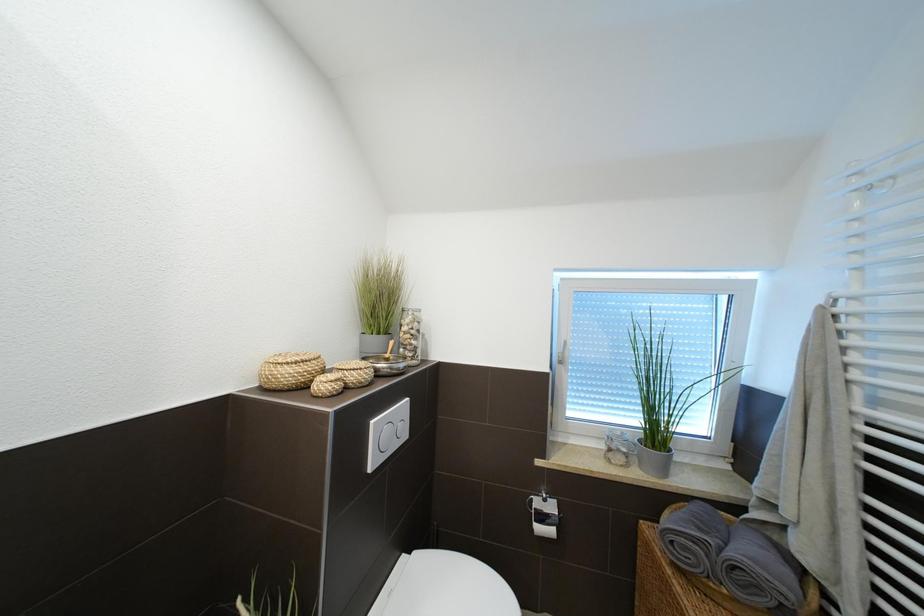
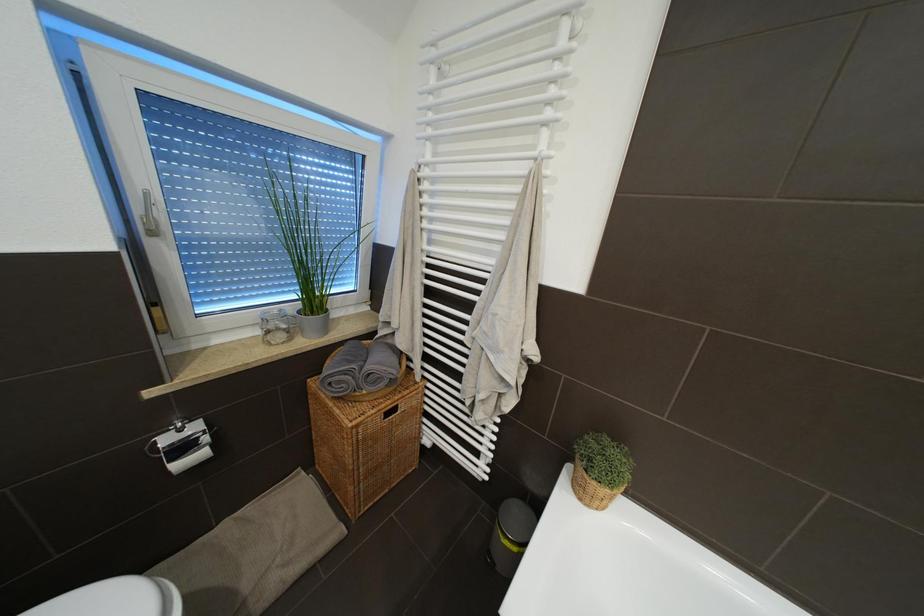
First-person continuous shooting, in which direction is the camera rotating?

The camera rotated toward right-down.